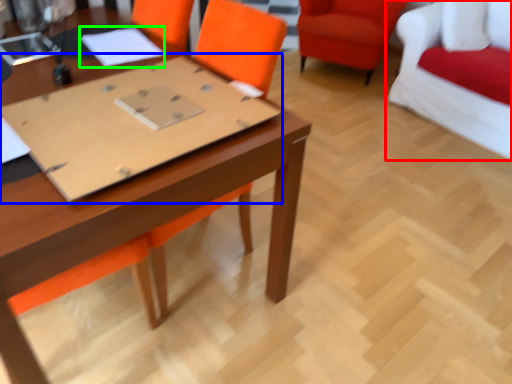
Question: Estimate the real-world distances between objects in this image. Which object is closer to chair (highlighted by a red box), cardboard (highlighted by a blue box) or notebook (highlighted by a green box)?

Choices:
 (A) cardboard
 (B) notebook

Answer: (B)